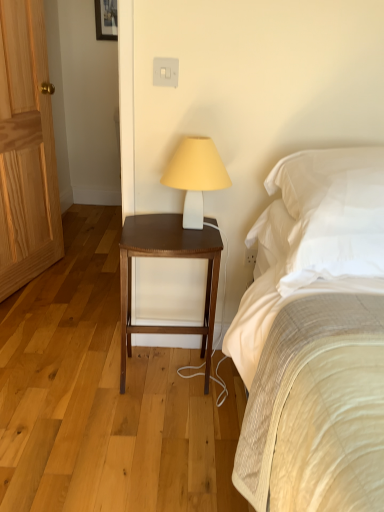
Question: Can you confirm if dark wood nightstand at center is bigger than white matte table lamp at upper center?

Choices:
 (A) yes
 (B) no

Answer: (A)

Question: Does dark wood nightstand at center lie in front of white matte table lamp at upper center?

Choices:
 (A) no
 (B) yes

Answer: (A)

Question: Is dark wood nightstand at center wider than white matte table lamp at upper center?

Choices:
 (A) no
 (B) yes

Answer: (B)

Question: Does dark wood nightstand at center appear on the right side of white matte table lamp at upper center?

Choices:
 (A) no
 (B) yes

Answer: (A)

Question: From the image's perspective, does dark wood nightstand at center appear lower than white matte table lamp at upper center?

Choices:
 (A) yes
 (B) no

Answer: (A)

Question: Is dark wood nightstand at center spatially inside white matte table lamp at upper center, or outside of it?

Choices:
 (A) inside
 (B) outside

Answer: (B)

Question: Considering the relative positions of dark wood nightstand at center and white matte table lamp at upper center in the image provided, is dark wood nightstand at center to the left or to the right of white matte table lamp at upper center?

Choices:
 (A) right
 (B) left

Answer: (B)

Question: Is dark wood nightstand at center bigger or smaller than white matte table lamp at upper center?

Choices:
 (A) big
 (B) small

Answer: (A)

Question: Considering the positions of dark wood nightstand at center and white matte table lamp at upper center in the image, is dark wood nightstand at center taller or shorter than white matte table lamp at upper center?

Choices:
 (A) tall
 (B) short

Answer: (A)

Question: Looking at their shapes, would you say white matte table lamp at upper center is wider or thinner than dark wood nightstand at center?

Choices:
 (A) wide
 (B) thin

Answer: (B)

Question: Is white matte table lamp at upper center inside the boundaries of dark wood nightstand at center, or outside?

Choices:
 (A) inside
 (B) outside

Answer: (B)

Question: Considering the relative positions of white matte table lamp at upper center and dark wood nightstand at center in the image provided, is white matte table lamp at upper center to the left or to the right of dark wood nightstand at center?

Choices:
 (A) right
 (B) left

Answer: (A)

Question: Relative to dark wood nightstand at center, is white matte table lamp at upper center in front or behind?

Choices:
 (A) behind
 (B) front

Answer: (B)

Question: Is point (162, 177) closer or farther from the camera than point (327, 218)?

Choices:
 (A) farther
 (B) closer

Answer: (A)

Question: Is white matte table lamp at upper center inside the boundaries of white soft pillow at upper right, or outside?

Choices:
 (A) inside
 (B) outside

Answer: (B)